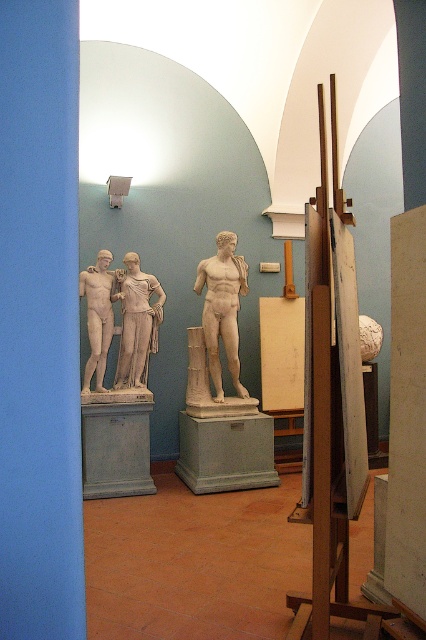
Describe the element at coordinates (222, 308) in the screenshot. I see `marble statue at center` at that location.

Between point (224, 273) and point (135, 333), which one is positioned in front?

Positioned in front is point (135, 333).

The image size is (426, 640). I want to click on marble statue at center, so click(x=222, y=308).

Which is behind, point (138, 355) or point (98, 296)?

The point (138, 355) is behind.

Which is more to the left, white marble statue at center or matte white statue at center?

matte white statue at center

Between point (138, 372) and point (109, 273), which one is positioned in front?

Point (138, 372) is in front.

Where is `white marble statue at center`? The image size is (426, 640). white marble statue at center is located at coordinates (137, 323).

Is point (213, 344) behind point (100, 259)?

Yes, point (213, 344) is behind point (100, 259).

Which of these two, marble statue at center or matte white statue at center, stands taller?

marble statue at center is taller.

Which is in front, point (221, 250) or point (103, 392)?

Point (103, 392) is more forward.

The image size is (426, 640). I want to click on marble statue at center, so click(x=222, y=308).